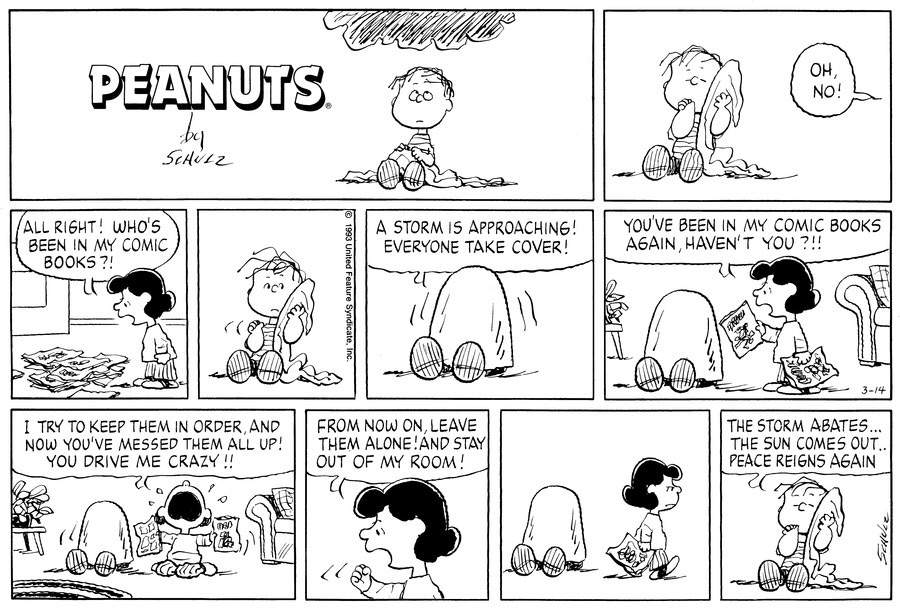
The image size is (900, 612). I want to click on security blanket, so click(x=824, y=504), click(x=556, y=513), click(x=101, y=517), click(x=299, y=289), click(x=464, y=293), click(x=680, y=312), click(x=725, y=76), click(x=448, y=173).